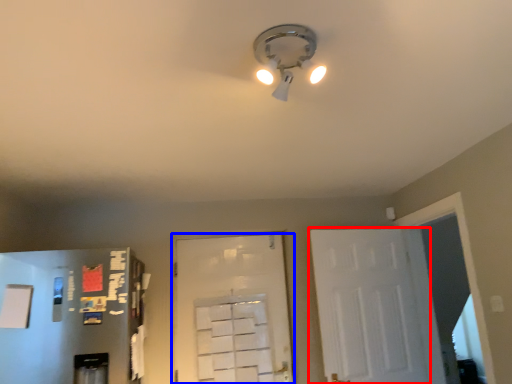
Question: Which object is further to the camera taking this photo, door (highlighted by a red box) or door (highlighted by a blue box)?

Choices:
 (A) door
 (B) door

Answer: (B)